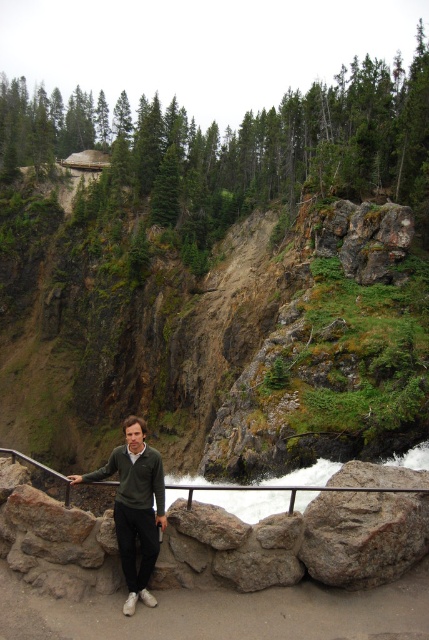
Question: Considering the real-world distances, which object is farthest from the dark green sweater at center?

Choices:
 (A) black metal/rail at lower center
 (B) green mossy rock at upper center

Answer: (B)

Question: Does dark green sweater at center appear over black metal/rail at lower center?

Choices:
 (A) no
 (B) yes

Answer: (B)

Question: Does green mossy rock at upper center have a greater width compared to dark green sweater at center?

Choices:
 (A) no
 (B) yes

Answer: (B)

Question: Which object is closer to the camera taking this photo?

Choices:
 (A) black metal/rail at lower center
 (B) dark green sweater at center
 (C) green mossy rock at upper center

Answer: (B)

Question: Where is green mossy rock at upper center located in relation to dark green sweater at center in the image?

Choices:
 (A) below
 (B) above

Answer: (B)

Question: Estimate the real-world distances between objects in this image. Which object is closer to the black metal/rail at lower center?

Choices:
 (A) dark green sweater at center
 (B) green mossy rock at upper center

Answer: (A)